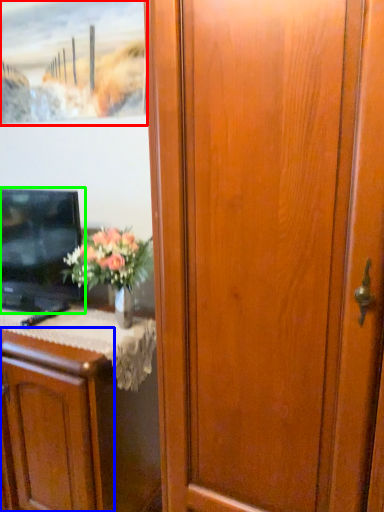
Question: Which object is the closest to the picture frame (highlighted by a red box)? Choose among these: cabinetry (highlighted by a blue box) or television (highlighted by a green box).

Choices:
 (A) cabinetry
 (B) television

Answer: (B)